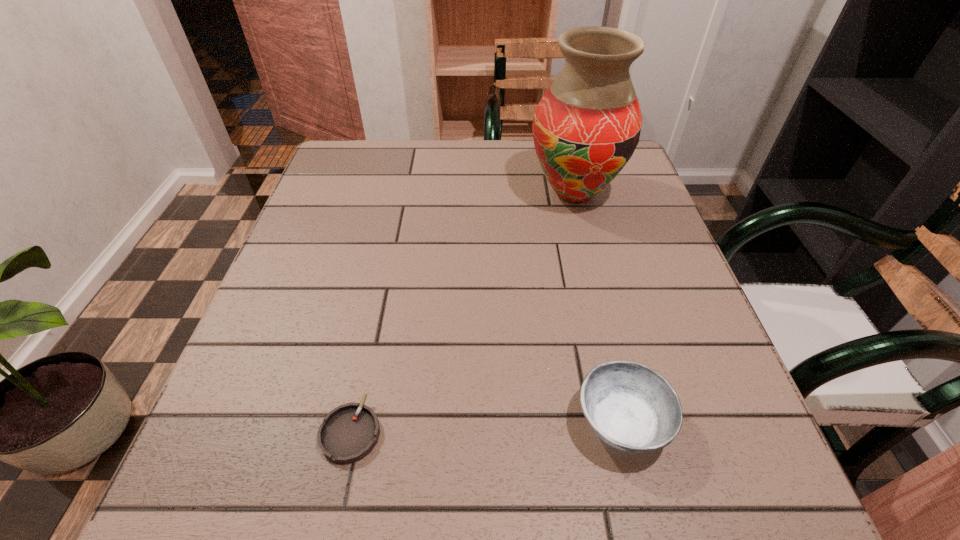
You are a GUI agent. You are given a task and a screenshot of the screen. Output one action in this format:
    pyautogui.click(x=<x>, y=<y>)
    Task: Click on the free space between the shortest object and the taller ashtray
    The height and width of the screenshot is (540, 960).
    Given the screenshot: What is the action you would take?
    pyautogui.click(x=486, y=427)

The width and height of the screenshot is (960, 540). I want to click on object that is the closest to the right ashtray, so click(348, 433).

This screenshot has height=540, width=960. Identify the location of object that is the second nearest to the left ashtray. (586, 127).

Locate an element on the screen. This screenshot has width=960, height=540. free location that satisfies the following two spatial constraints: 1. on the back side of the vase; 2. on the left side of the leftmost object is located at coordinates (401, 193).

The height and width of the screenshot is (540, 960). Find the location of `free location that satisfies the following two spatial constraints: 1. on the back side of the farthest object; 2. on the left side of the leftmost object`. free location that satisfies the following two spatial constraints: 1. on the back side of the farthest object; 2. on the left side of the leftmost object is located at coordinates (401, 193).

Locate an element on the screen. vacant area that satisfies the following two spatial constraints: 1. on the back side of the tallest object; 2. on the right side of the shorter ashtray is located at coordinates (401, 193).